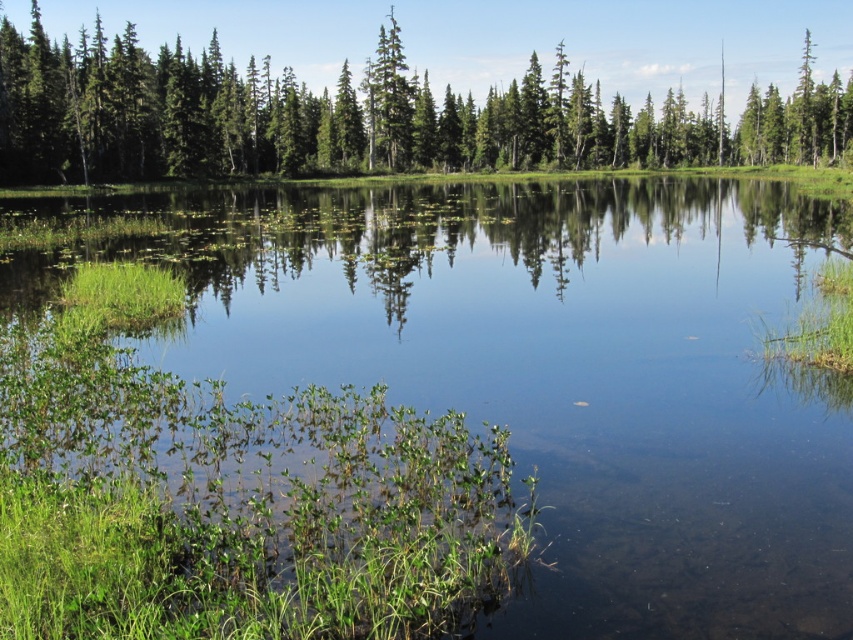
Which is more to the left, clear water at center or green matte tree at center?

Positioned to the left is clear water at center.

How distant is clear water at center from green matte tree at center?

The distance of clear water at center from green matte tree at center is 63.59 meters.

What do you see at coordinates (561, 372) in the screenshot? I see `clear water at center` at bounding box center [561, 372].

The width and height of the screenshot is (853, 640). I want to click on clear water at center, so click(x=561, y=372).

Can you confirm if green glossy trees at upper center is bigger than green matte tree at center?

Yes, green glossy trees at upper center is bigger than green matte tree at center.

Is green glossy trees at upper center shorter than green matte tree at center?

In fact, green glossy trees at upper center may be taller than green matte tree at center.

Who is more forward, [757,45] or [396,88]?

Point [396,88] is more forward.

Locate an element on the screen. Image resolution: width=853 pixels, height=640 pixels. green glossy trees at upper center is located at coordinates (368, 115).

Between clear water at center and green glossy trees at upper center, which one appears on the right side from the viewer's perspective?

green glossy trees at upper center

Can you confirm if clear water at center is positioned below green glossy trees at upper center?

Yes.

In order to click on clear water at center in this screenshot , I will do `click(561, 372)`.

You are a GUI agent. You are given a task and a screenshot of the screen. Output one action in this format:
    pyautogui.click(x=<x>, y=<y>)
    Task: Click on the clear water at center
    This screenshot has width=853, height=640.
    Given the screenshot: What is the action you would take?
    pyautogui.click(x=561, y=372)